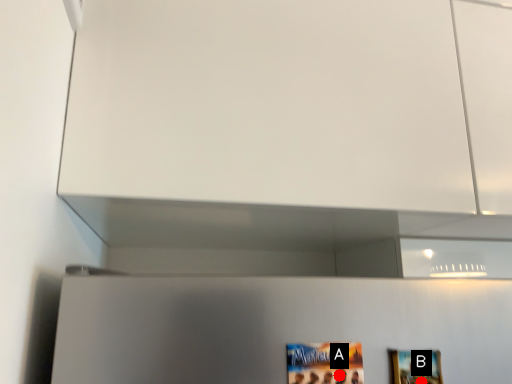
Question: Two points are circled on the image, labeled by A and B beside each circle. Which point is closer to the camera?

Choices:
 (A) A is closer
 (B) B is closer

Answer: (A)